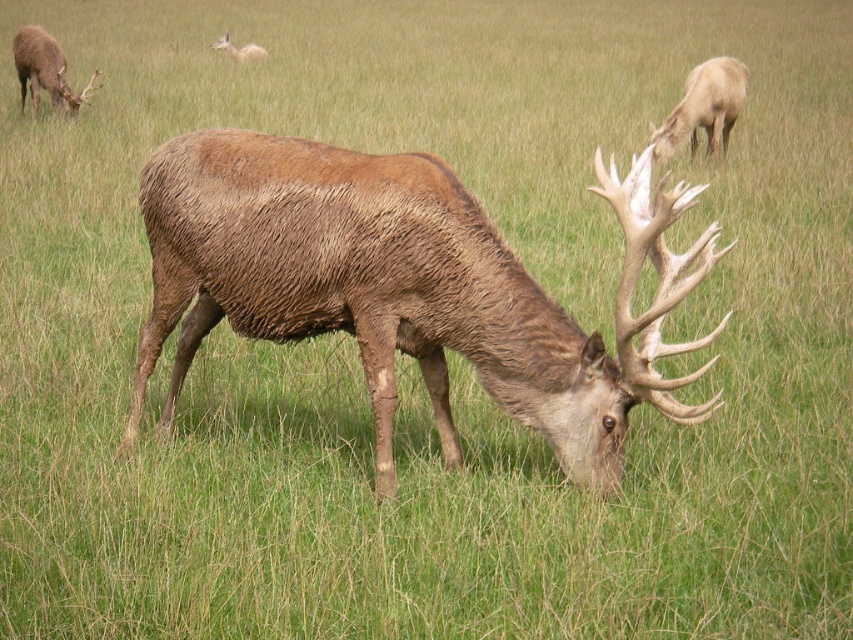
Question: Can you confirm if light brown fur at upper right is bigger than brown velvet deer at upper center?

Choices:
 (A) no
 (B) yes

Answer: (B)

Question: Which object is the farthest from the brown furry deer at center?

Choices:
 (A) brown velvet deer at upper center
 (B) brown velvet deer at upper left
 (C) light brown fur at upper right

Answer: (A)

Question: Which of the following is the closest to the observer?

Choices:
 (A) brown velvet deer at upper center
 (B) brown furry deer at center

Answer: (B)

Question: Does brown furry deer at center appear on the right side of brown velvet deer at upper left?

Choices:
 (A) yes
 (B) no

Answer: (A)

Question: Which object is farther from the camera taking this photo?

Choices:
 (A) brown velvet deer at upper left
 (B) light brown fur at upper right

Answer: (A)

Question: Can you confirm if brown furry deer at center is positioned below brown velvet deer at upper left?

Choices:
 (A) no
 (B) yes

Answer: (B)